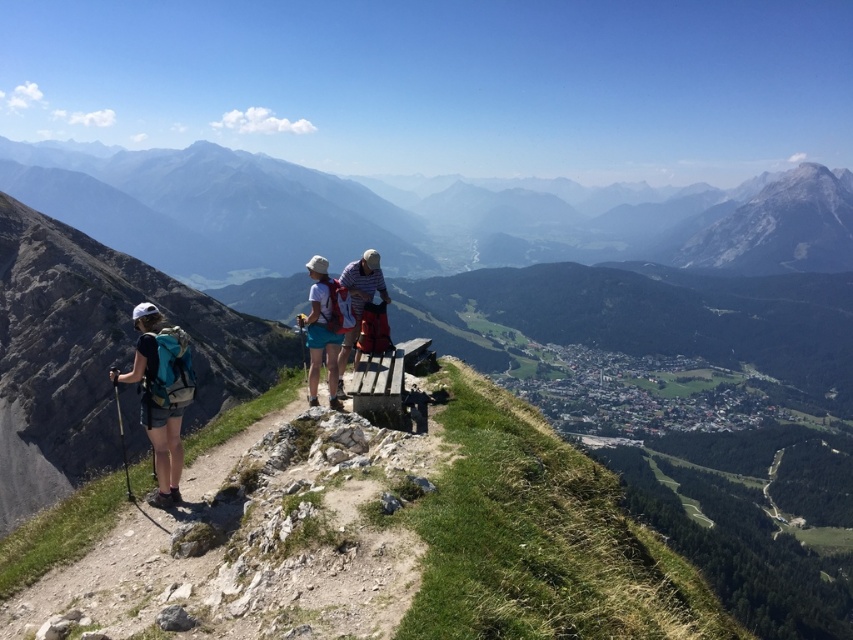
Question: Which point is closer to the camera?

Choices:
 (A) rocky mountain at center
 (B) striped cotton shirt at center

Answer: (B)

Question: Which object is the closest to the rocky mountain at center?

Choices:
 (A) striped cotton shirt at center
 (B) matte blue shorts at center
 (C) matte teal backpack at left

Answer: (C)

Question: From the image, what is the correct spatial relationship of rocky mountain at center in relation to matte blue shorts at center?

Choices:
 (A) right
 (B) left

Answer: (B)

Question: Can you confirm if matte teal backpack at left is positioned to the right of matte blue shorts at center?

Choices:
 (A) yes
 (B) no

Answer: (B)

Question: Is matte blue shorts at center closer to the viewer compared to striped cotton shirt at center?

Choices:
 (A) no
 (B) yes

Answer: (B)

Question: Which of the following is the closest to the observer?

Choices:
 (A) matte blue shorts at center
 (B) rocky mountain at center
 (C) striped cotton shirt at center
 (D) matte teal backpack at left

Answer: (D)